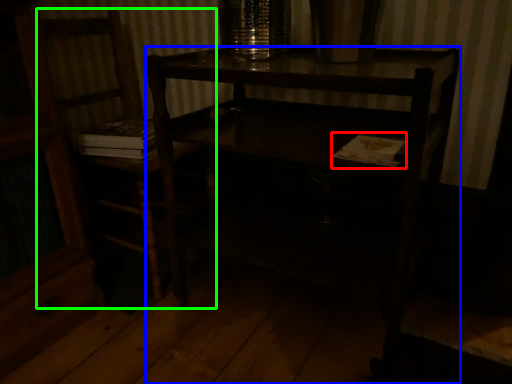
Question: Based on their relative distances, which object is farther from book (highlighted by a red box)? Choose from desk (highlighted by a blue box) and chair (highlighted by a green box).

Choices:
 (A) desk
 (B) chair

Answer: (B)